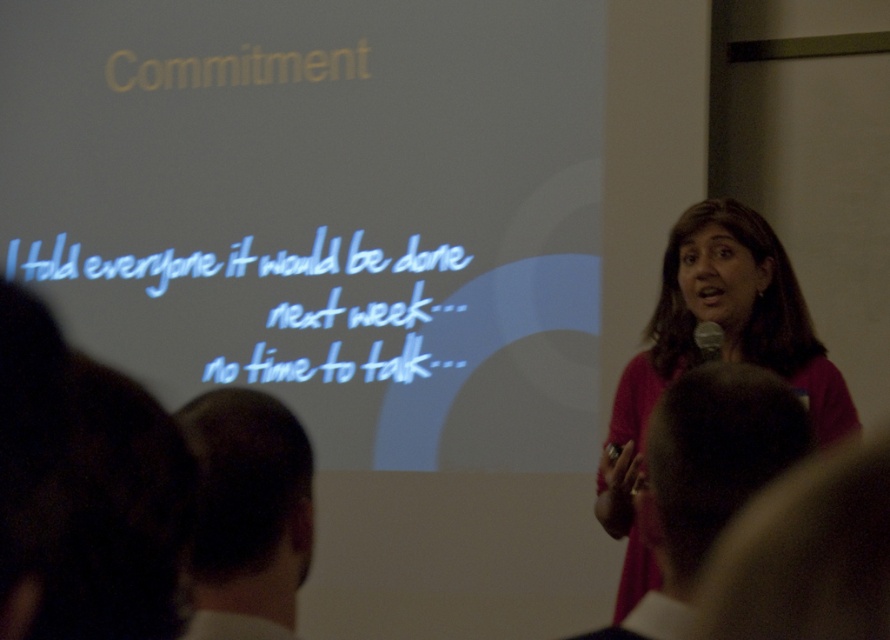
Does dark brown hair at lower left appear on the right side of white handwritten text at center?

Correct, you'll find dark brown hair at lower left to the right of white handwritten text at center.

Is point (193, 616) behind point (91, 264)?

No, (193, 616) is closer to viewer.

Who is more forward, (239, 483) or (213, 268)?

Point (239, 483) is more forward.

Locate an element on the screen. This screenshot has height=640, width=890. dark brown hair at lower left is located at coordinates (247, 512).

Does white handwritten text at center have a smaller size compared to metallic silver microphone at upper right?

Actually, white handwritten text at center might be larger than metallic silver microphone at upper right.

Where is `white handwritten text at center`? white handwritten text at center is located at coordinates (231, 262).

Where is `white handwritten text at center`? white handwritten text at center is located at coordinates (231, 262).

Which is below, smooth bald head at right or metallic silver microphone at upper right?

Positioned lower is smooth bald head at right.

Is smooth bald head at right positioned at the back of metallic silver microphone at upper right?

No.

Is point (727, 410) farther from viewer compared to point (698, 330)?

No, (727, 410) is in front of (698, 330).

Where is `smooth bald head at right`? This screenshot has width=890, height=640. smooth bald head at right is located at coordinates (705, 476).